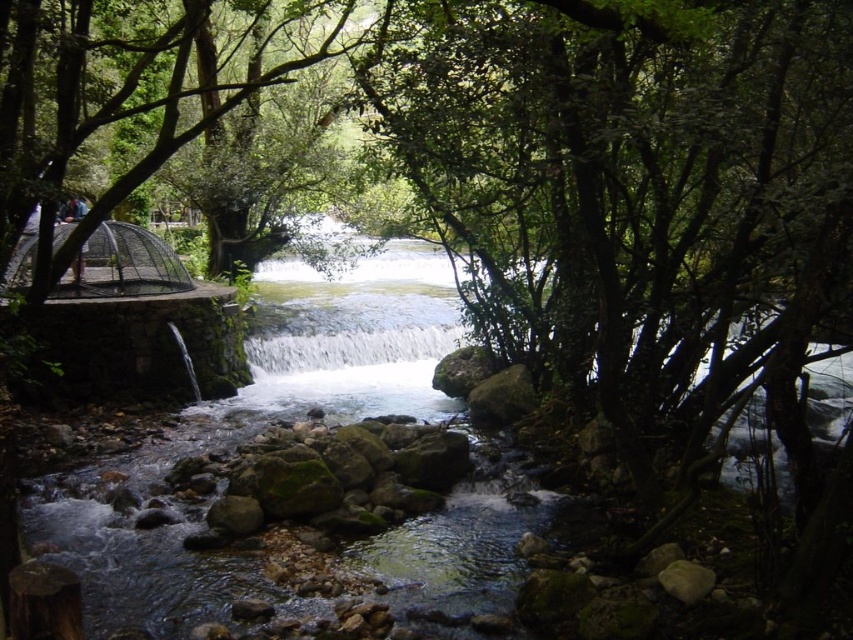
You are standing at the edge of the stream and want to take a photo of both the green leafy tree at center and the white smooth waterfall at center. Which object should you focus on first to ensure both are in sharp focus?

You should focus on the green leafy tree at center first since it is closer to the viewer than the white smooth waterfall at center. By focusing on the closer object, the waterfall will also be in focus due to the depth of field.

You are a hiker who wants to take a photo of the white smooth waterfall at center without any obstructions. Is the green leafy tree at center blocking your view of the waterfall?

The green leafy tree at center is positioned over the white smooth waterfall at center, so it is blocking the view of the waterfall. To take an unobstructed photo, you would need to move to a different angle or position where the tree is not in front of the waterfall.